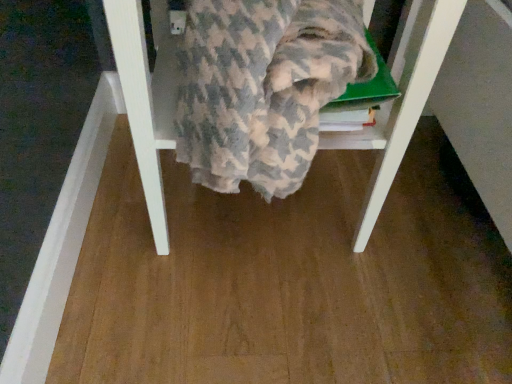
Image resolution: width=512 pixels, height=384 pixels. In order to click on textured fabric blanket at center in this screenshot , I will do `click(400, 102)`.

Looking at this image, what is the approximate height of textured fabric blanket at center?

18.75 inches.

Image resolution: width=512 pixels, height=384 pixels. Describe the element at coordinates (400, 102) in the screenshot. I see `textured fabric blanket at center` at that location.

At what (x,y) coordinates should I click in order to perform the action: click on textured fabric blanket at center. Please return your answer as a coordinate pair (x, y). The image size is (512, 384). Looking at the image, I should click on (400, 102).